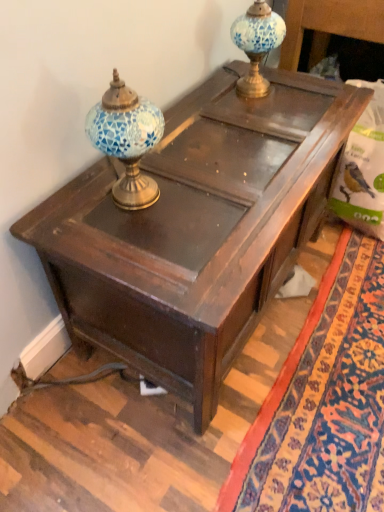
This screenshot has height=512, width=384. I want to click on free point in front of blue mosaic glass lamp at upper center, acting as the 1th candle holder starting from the back, so click(x=244, y=110).